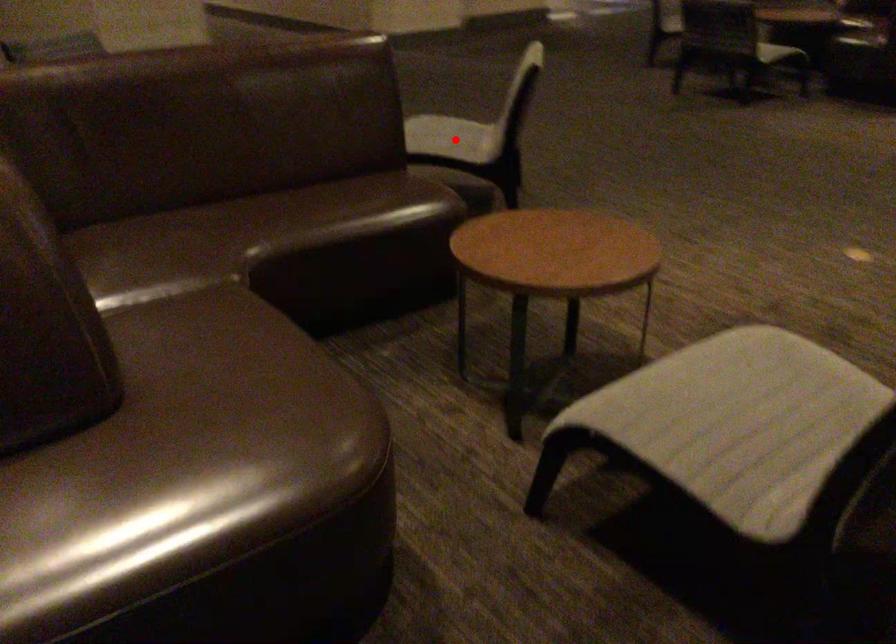
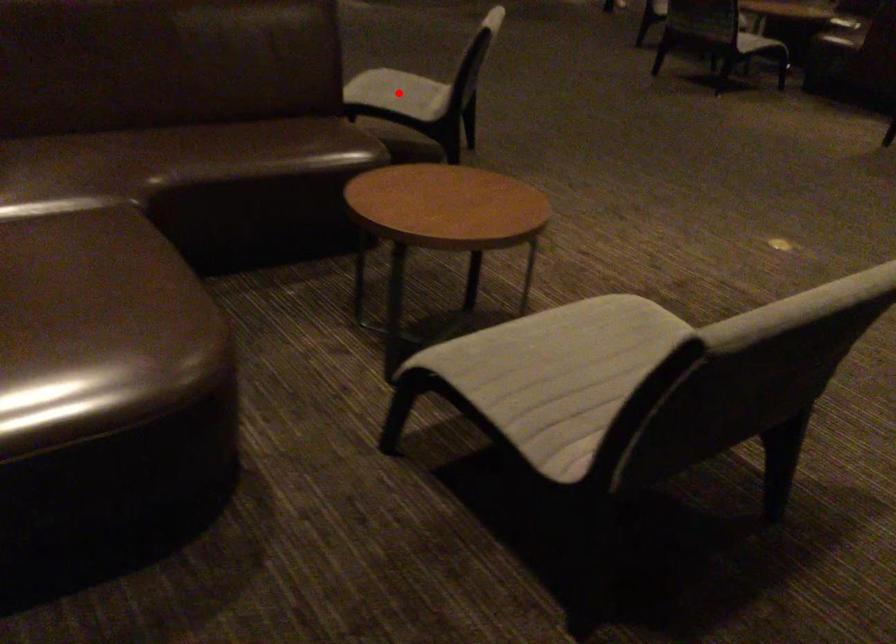
I am providing you with two images of the same scene from different viewpoints. A red point is marked on the first image and another point is marked on the second image. Is the red point in image1 aligned with the point shown in image2?

Yes